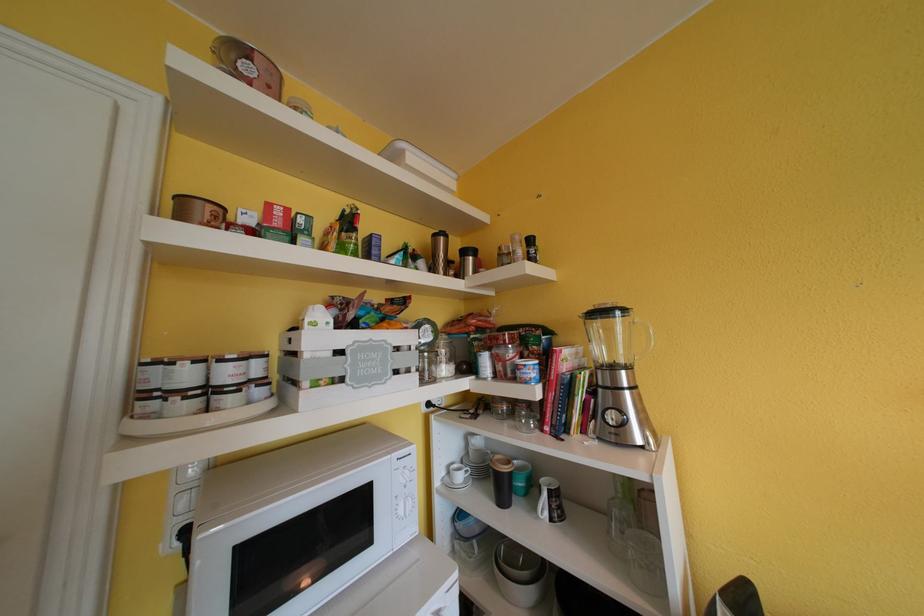
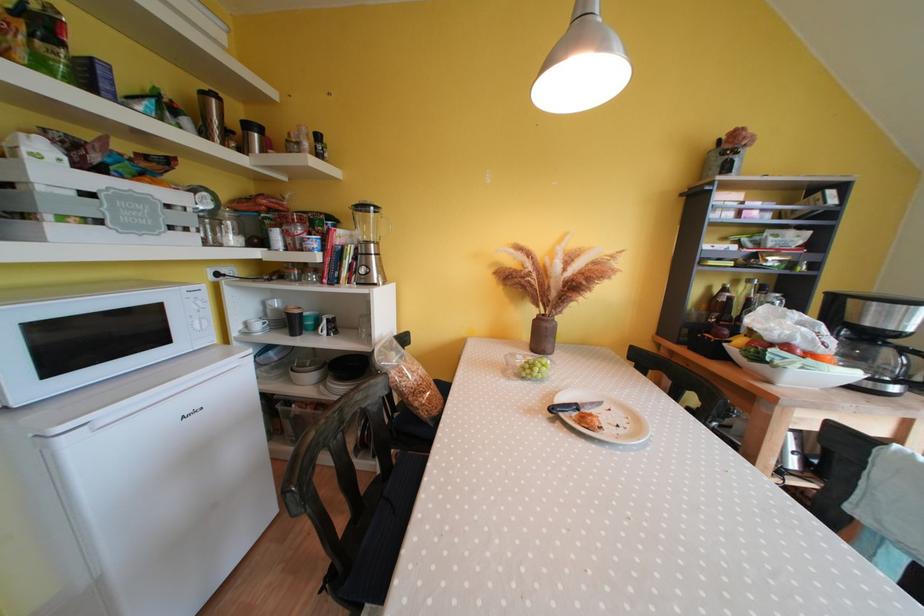
Find the pixel in the second image that matches point (467, 480) in the first image.

(264, 330)